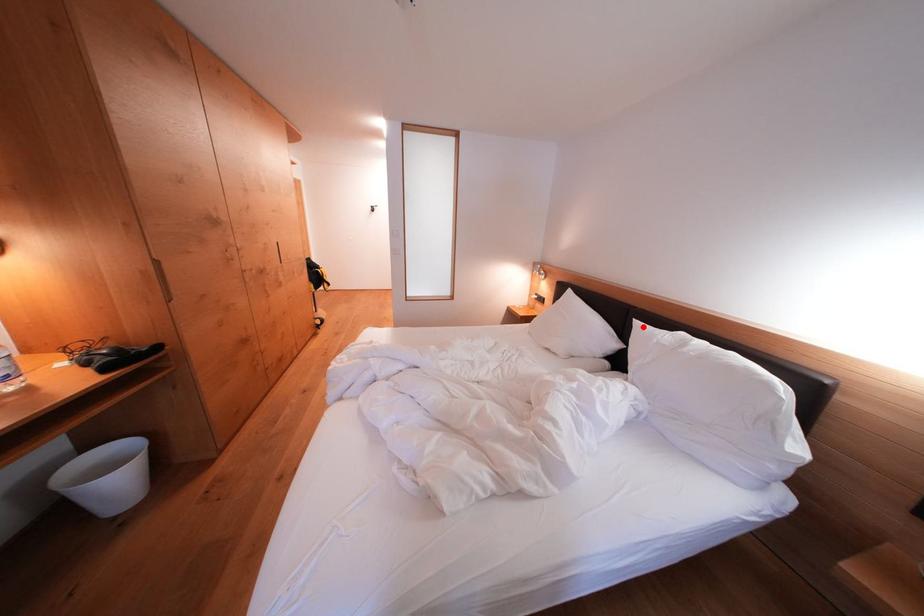
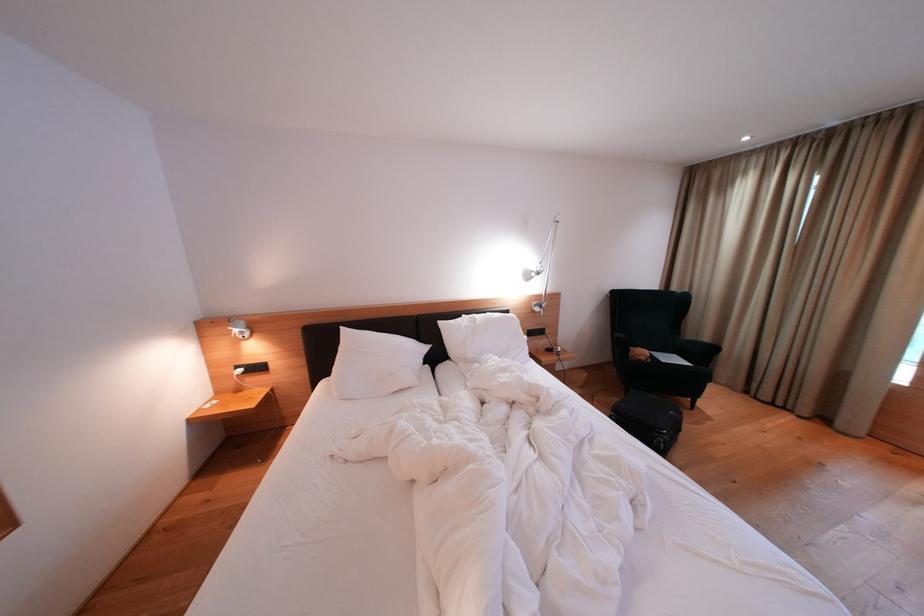
Question: I am providing you with two images of the same scene from different viewpoints. Given a red point in image1, look at the same physical point in image2. Is it:

Choices:
 (A) Closer to the viewpoint
 (B) Farther from the viewpoint

Answer: (B)